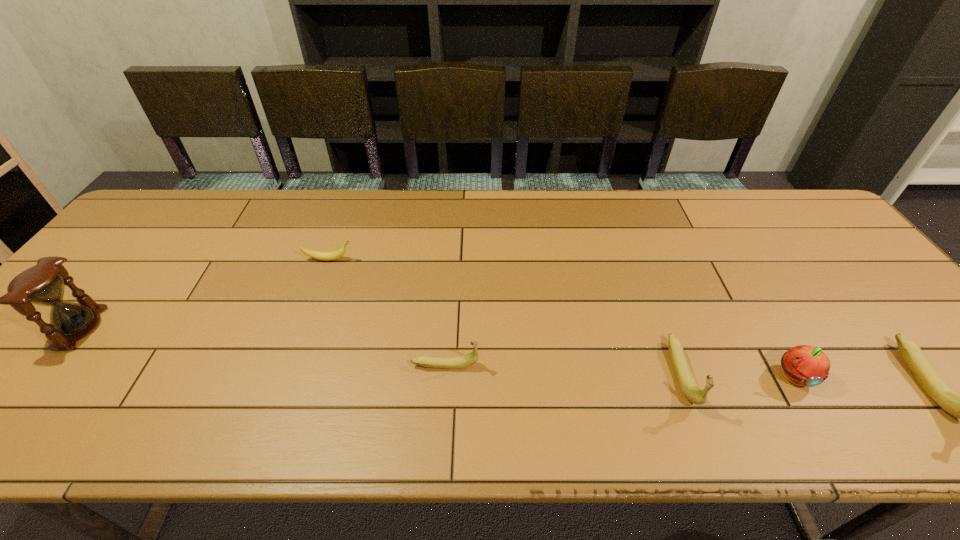
Please point out where to position a new banana on the left to maintain spacing. Please provide its 2D coordinates. Your answer should be formatted as a tuple, i.e. [(x, y)], where the tuple contains the x and y coordinates of a point satisfying the conditions above.

[(217, 356)]